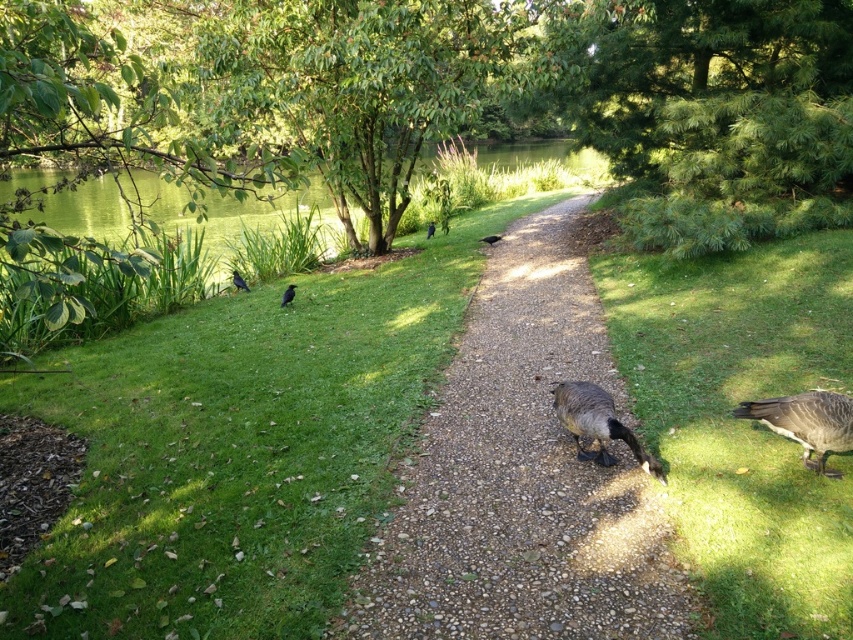
In the park scene, there are two birds visible. One is a shiny black bird at center left and the other is a black glossy bird at center. Which of these two birds is taller?

The shiny black bird at center left is taller than the black glossy bird at center.

You are a photographer aiming to capture both the dark gray feathered duck at lower right and the shiny black bird at left in a single shot. Which bird would appear larger in the photo?

The dark gray feathered duck at lower right would appear larger in the photo because it is closer to the viewer than the shiny black bird at left.

You are a park visitor who wants to walk along the smooth gravel path at center without stepping on the dark gray feathered duck at center. Is this possible?

The smooth gravel path at center is above the dark gray feathered duck at center, so the path is elevated and does not intersect with the duck. You can walk along the smooth gravel path at center safely without stepping on the dark gray feathered duck at center.